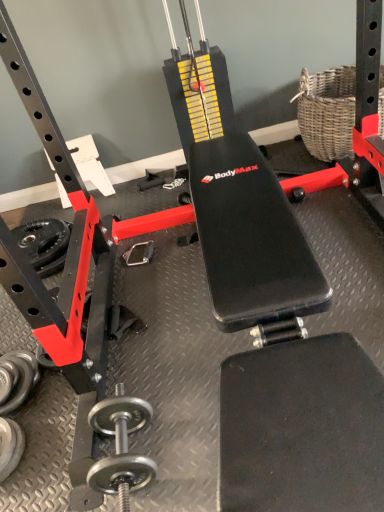
What are the coordinates of `vacant space positioned to the left of polished silver dumbbell at lower left, which ranks as the third dumbbell in left-to-right order` in the screenshot? It's located at (51, 465).